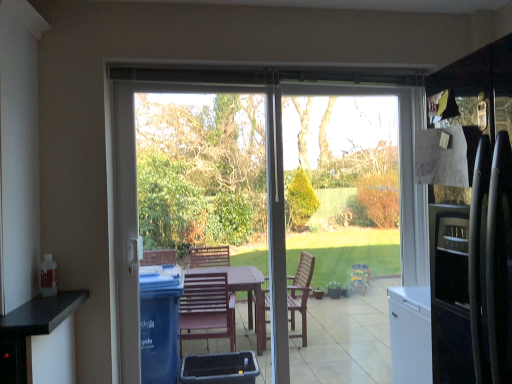
Question: Considering the positions of transparent glass door at center and transparent glass window screen at center in the image, is transparent glass door at center wider or thinner than transparent glass window screen at center?

Choices:
 (A) thin
 (B) wide

Answer: (B)

Question: From a real-world perspective, relative to transparent glass window screen at center, is transparent glass door at center vertically above or below?

Choices:
 (A) above
 (B) below

Answer: (B)

Question: Which is farther from the transparent glass door at center?

Choices:
 (A) transparent glass window screen at center
 (B) transparent plastic screen door at center

Answer: (B)

Question: Considering the real-world distances, which object is farthest from the transparent glass window screen at center?

Choices:
 (A) transparent glass door at center
 (B) transparent plastic screen door at center

Answer: (B)